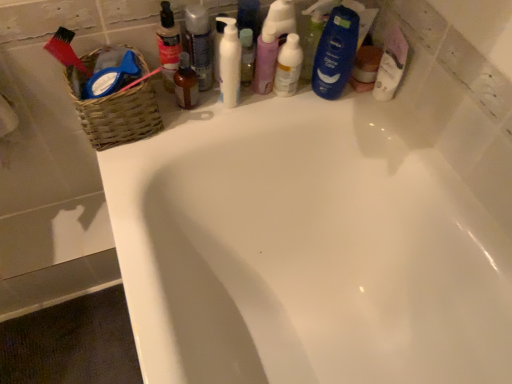
Locate an element on the screen. free point to the right of blue glossy shampoo bottle at upper right, which ranks as the fifth toiletry in left-to-right order is located at coordinates click(x=381, y=112).